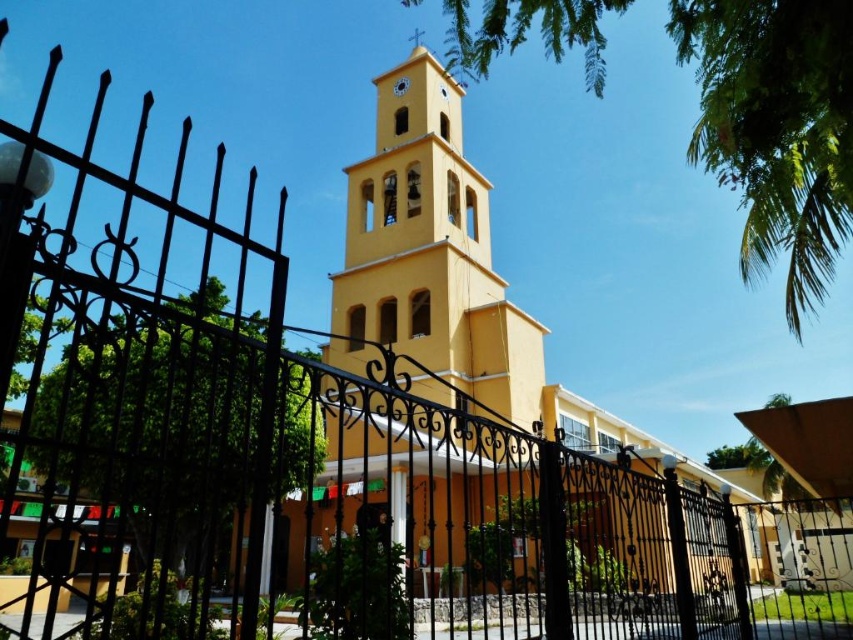
Is yellow matte bell tower at center smaller than matte yellow clock at upper center?

Actually, yellow matte bell tower at center might be larger than matte yellow clock at upper center.

Does yellow matte bell tower at center come in front of matte yellow clock at upper center?

Yes, yellow matte bell tower at center is closer to the viewer.

Find the location of a particular element. Image resolution: width=853 pixels, height=640 pixels. yellow matte bell tower at center is located at coordinates (x=430, y=262).

I want to click on yellow matte bell tower at center, so click(x=430, y=262).